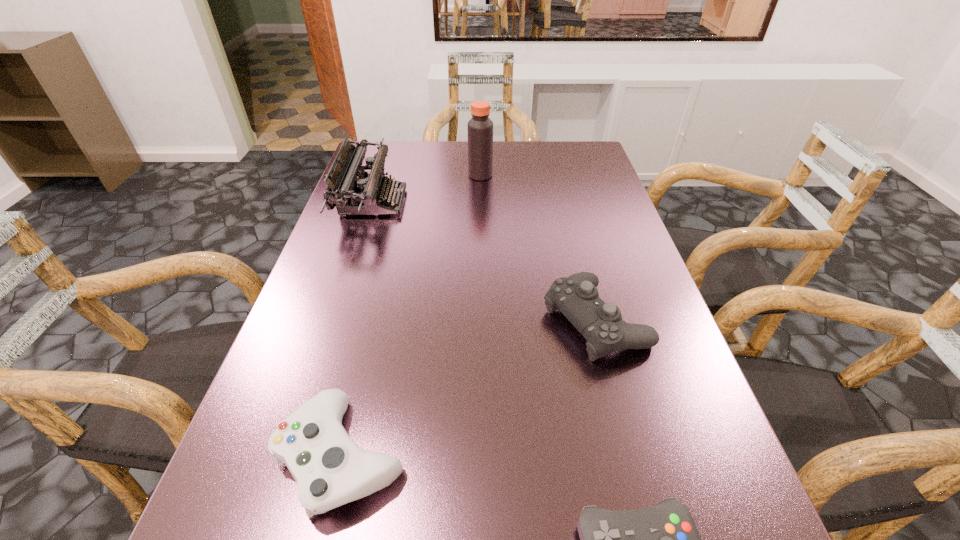
You are a GUI agent. You are given a task and a screenshot of the screen. Output one action in this format:
    pyautogui.click(x=<x>, y=<y>)
    Task: Click on the vinegar
    The image size is (960, 540).
    Given the screenshot: What is the action you would take?
    pyautogui.click(x=480, y=127)

I want to click on the tallest object, so click(x=480, y=127).

I want to click on typewriter, so click(x=352, y=196).

Locate an element on the screen. This screenshot has width=960, height=540. the farthest control is located at coordinates (576, 297).

You are a GUI agent. You are given a task and a screenshot of the screen. Output one action in this format:
    pyautogui.click(x=<x>, y=<y>)
    Task: Click on the tallest control
    The height and width of the screenshot is (540, 960).
    Given the screenshot: What is the action you would take?
    pyautogui.click(x=576, y=297)

Where is `the leftmost control`? This screenshot has width=960, height=540. the leftmost control is located at coordinates (330, 469).

Locate an element on the screen. blank area located 0.230m on the right of the third object from right to left is located at coordinates (571, 175).

Locate an element on the screen. The height and width of the screenshot is (540, 960). vacant region located 0.180m on the typing side of the typewriter is located at coordinates (471, 202).

Where is `vacant space located on the left of the tallest control`? The image size is (960, 540). vacant space located on the left of the tallest control is located at coordinates (427, 321).

Locate an element on the screen. This screenshot has width=960, height=540. free space located on the right of the leftmost control is located at coordinates (665, 455).